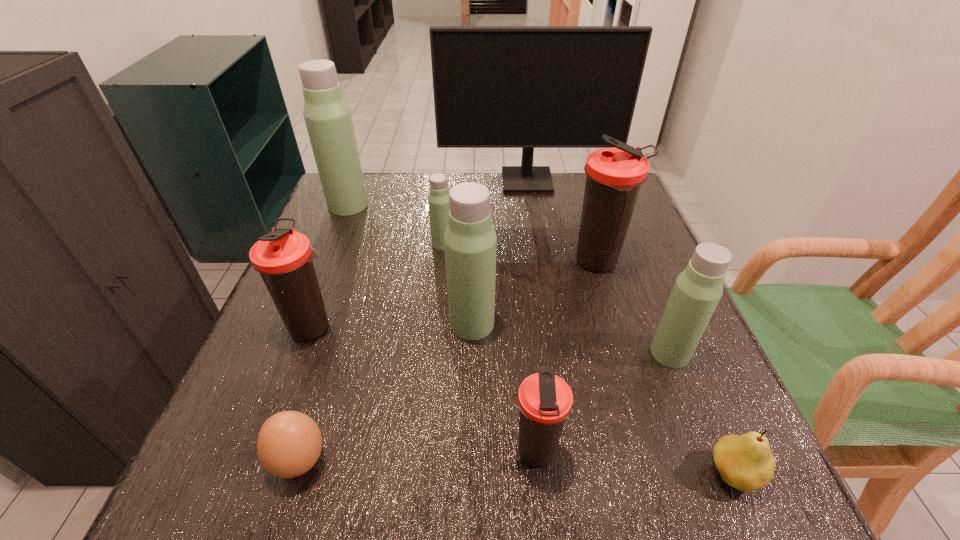
Image resolution: width=960 pixels, height=540 pixels. I want to click on vacant space located 0.340m on the right of the second nearest brown thermos bottle, so click(x=514, y=327).

Identify the location of vacant area located 0.050m on the left of the third biggest light thermos bottle. Image resolution: width=960 pixels, height=540 pixels. (624, 353).

This screenshot has width=960, height=540. I want to click on free region located on the right of the smallest light thermos bottle, so click(x=595, y=244).

The height and width of the screenshot is (540, 960). I want to click on vacant area situated on the back of the nearest brown thermos bottle, so click(x=517, y=275).

Image resolution: width=960 pixels, height=540 pixels. I want to click on vacant region located 0.360m on the back of the pear, so click(654, 289).

The image size is (960, 540). I want to click on free region located on the right of the brown boiled egg, so click(487, 461).

The height and width of the screenshot is (540, 960). I want to click on computer monitor situated at the far edge, so click(x=527, y=87).

Identify the location of thermos bottle that is at the far edge. (327, 116).

The height and width of the screenshot is (540, 960). In order to click on thermos bottle located in the near edge section of the desktop in this screenshot , I will do `click(545, 400)`.

At what (x,y) coordinates should I click in order to perform the action: click on pear that is positioned at the near edge. Please return your answer as a coordinate pair (x, y). Looking at the image, I should click on (745, 462).